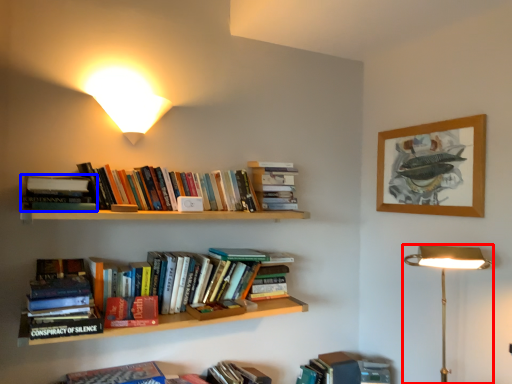
Question: Among these objects, which one is nearest to the camera, lamp (highlighted by a red box) or book (highlighted by a blue box)?

Choices:
 (A) lamp
 (B) book

Answer: (A)